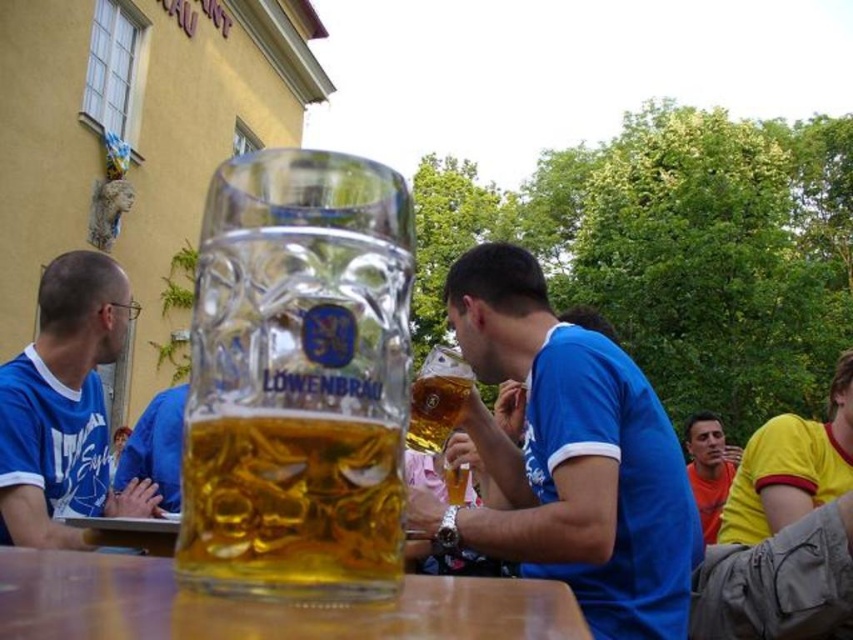
Question: Which point is farther to the camera?

Choices:
 (A) blue jersey at left
 (B) translucent glass mug at center
 (C) matte blue shirt at lower right
 (D) transparent glass table at center

Answer: (B)

Question: Which point appears farthest from the camera in this image?

Choices:
 (A) (461, 476)
 (B) (215, 512)

Answer: (A)

Question: Does blue jersey at left have a lesser width compared to translucent glass mug at center?

Choices:
 (A) yes
 (B) no

Answer: (A)

Question: Is transparent glass mug at center positioned behind blue jersey shirt at center?

Choices:
 (A) yes
 (B) no

Answer: (B)

Question: Is blue jersey shirt at center further to camera compared to transparent glass table at center?

Choices:
 (A) no
 (B) yes

Answer: (B)

Question: Among these objects, which one is farthest from the camera?

Choices:
 (A) blue jersey at left
 (B) transparent glass mug at center

Answer: (A)